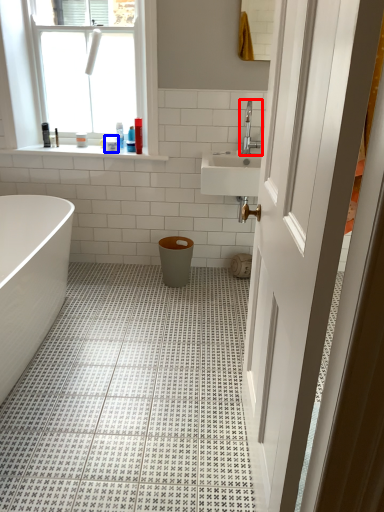
Question: Among these objects, which one is nearest to the camera, tap (highlighted by a red box) or toiletry (highlighted by a blue box)?

Choices:
 (A) tap
 (B) toiletry

Answer: (A)